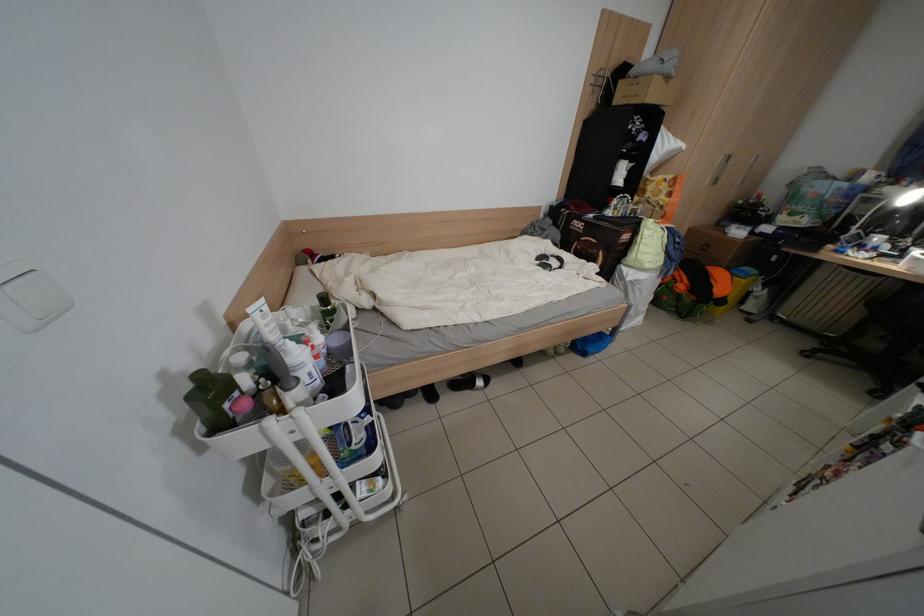
Describe the element at coordinates (311, 463) in the screenshot. I see `the white cart handle` at that location.